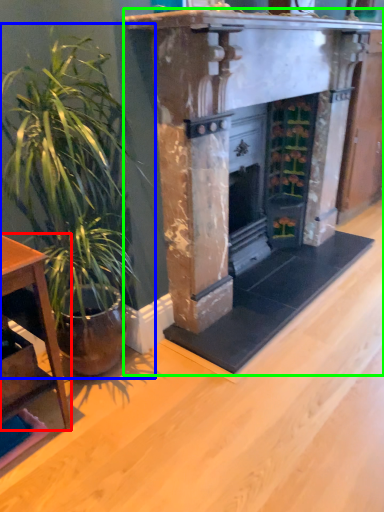
Question: Considering the real-world distances, which object is closest to table (highlighted by a red box)? houseplant (highlighted by a blue box) or fireplace (highlighted by a green box).

Choices:
 (A) houseplant
 (B) fireplace

Answer: (A)